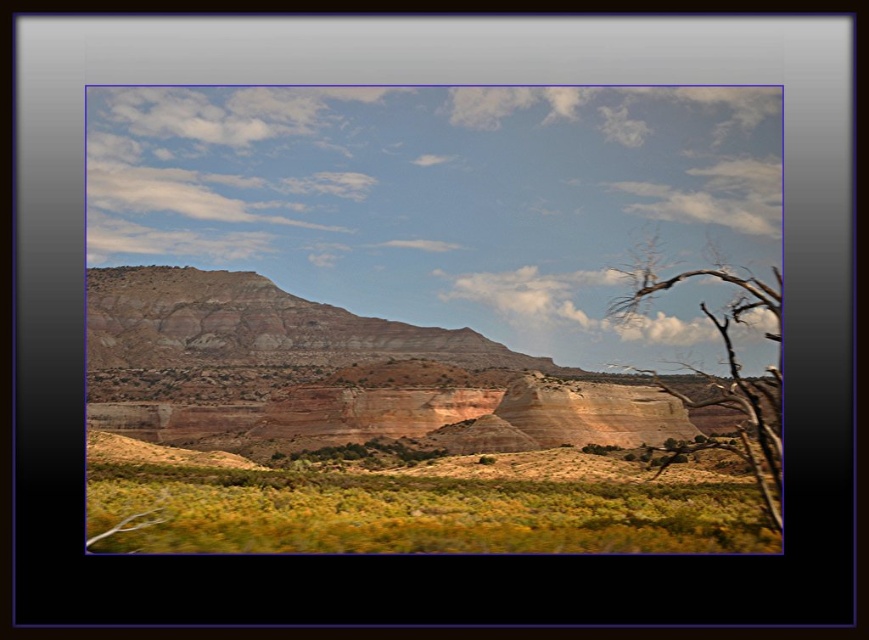
Question: Considering the real-world distances, which object is closest to the brown dry wood at right?

Choices:
 (A) green shrubbery at lower center
 (B) rustic sandstone cliffs at center

Answer: (A)

Question: Does rustic sandstone cliffs at center have a greater width compared to brown dry wood at right?

Choices:
 (A) yes
 (B) no

Answer: (A)

Question: Can you confirm if rustic sandstone cliffs at center is positioned below brown dry wood at right?

Choices:
 (A) no
 (B) yes

Answer: (B)

Question: Which point is closer to the camera taking this photo?

Choices:
 (A) (715, 476)
 (B) (648, 284)
 (C) (625, 504)

Answer: (B)

Question: Which point is closer to the camera taking this photo?

Choices:
 (A) (685, 272)
 (B) (691, 497)

Answer: (A)

Question: Is rustic sandstone cliffs at center above brown dry wood at right?

Choices:
 (A) yes
 (B) no

Answer: (B)